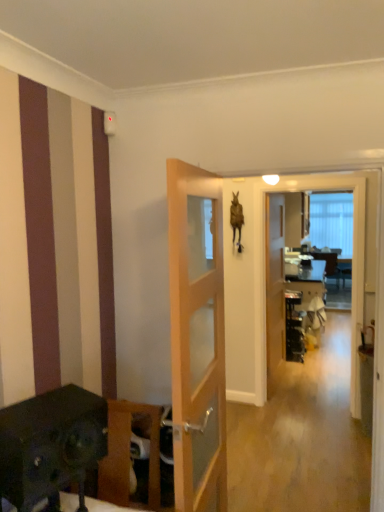
Question: From the image's perspective, is light wood/glass door at center, which appears as the second door when viewed from the back, under wooden door at center, the second door from the left?

Choices:
 (A) no
 (B) yes

Answer: (B)

Question: Can you see light wood/glass door at center, which appears as the second door when viewed from the back, touching wooden door at center, the second door from the left?

Choices:
 (A) yes
 (B) no

Answer: (B)

Question: Can you confirm if light wood/glass door at center, marked as the first door in a left-to-right arrangement, is taller than wooden door at center, the second door from the left?

Choices:
 (A) yes
 (B) no

Answer: (B)

Question: From a real-world perspective, is light wood/glass door at center, which is counted as the 2th door, starting from the right, on top of wooden door at center, the 1th door positioned from the right?

Choices:
 (A) yes
 (B) no

Answer: (A)

Question: Is wooden door at center, placed as the first door when sorted from back to front, inside light wood/glass door at center, the 1th door when ordered from front to back?

Choices:
 (A) no
 (B) yes

Answer: (A)

Question: Can you confirm if light wood/glass door at center, marked as the first door in a left-to-right arrangement, is shorter than wooden door at center, the second door from the left?

Choices:
 (A) no
 (B) yes

Answer: (B)

Question: Does light wood/glass door at center, which is counted as the 2th door, starting from the right, have a lesser width compared to transparent glass screen door at center?

Choices:
 (A) no
 (B) yes

Answer: (A)

Question: Is light wood/glass door at center, marked as the first door in a left-to-right arrangement, taller than transparent glass screen door at center?

Choices:
 (A) yes
 (B) no

Answer: (B)

Question: Is light wood/glass door at center, which is counted as the 2th door, starting from the right, bigger than transparent glass screen door at center?

Choices:
 (A) yes
 (B) no

Answer: (A)

Question: Does light wood/glass door at center, marked as the first door in a left-to-right arrangement, touch transparent glass screen door at center?

Choices:
 (A) no
 (B) yes

Answer: (A)

Question: From the image's perspective, is light wood/glass door at center, marked as the first door in a left-to-right arrangement, below transparent glass screen door at center?

Choices:
 (A) no
 (B) yes

Answer: (B)

Question: Can you confirm if light wood/glass door at center, the 1th door when ordered from front to back, is wider than transparent glass screen door at center?

Choices:
 (A) no
 (B) yes

Answer: (B)

Question: From the image's perspective, would you say wooden door at center, the 1th door positioned from the right, is shown under light wood/glass door at center, marked as the first door in a left-to-right arrangement?

Choices:
 (A) no
 (B) yes

Answer: (A)